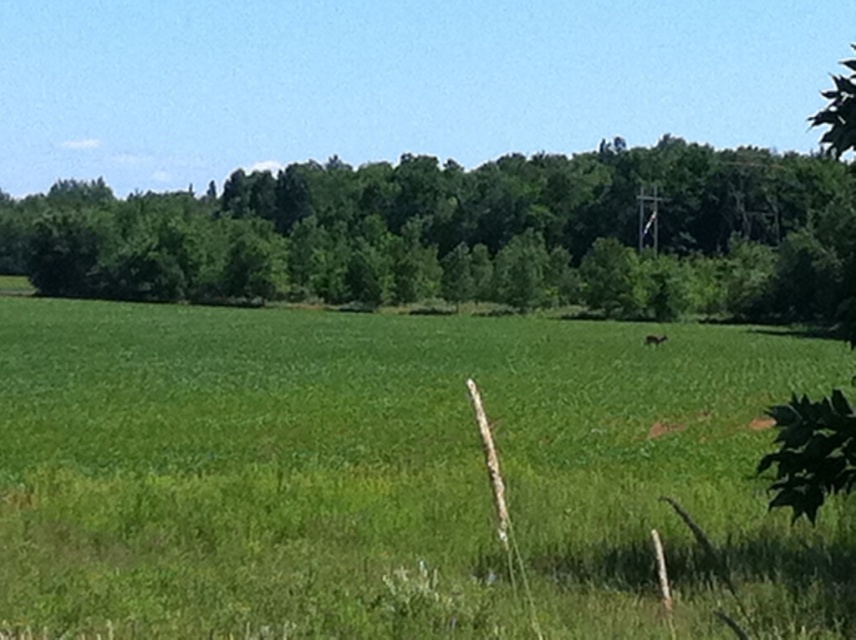
Can you confirm if green leafy tree at center is taller than brown furry deer at center?

Yes, green leafy tree at center is taller than brown furry deer at center.

Is point (837, 212) positioned behind point (645, 339)?

That is True.

Is point (715, 163) farther from camera compared to point (646, 344)?

Yes.

The image size is (856, 640). Identify the location of green leafy tree at center. (467, 234).

Describe the element at coordinates (394, 470) in the screenshot. The image size is (856, 640). I see `green grass pasture at center` at that location.

What are the coordinates of `green grass pasture at center` in the screenshot? It's located at (394, 470).

At what (x,y) coordinates should I click in order to perform the action: click on green grass pasture at center. Please return your answer as a coordinate pair (x, y). Image resolution: width=856 pixels, height=640 pixels. Looking at the image, I should click on (394, 470).

Does green grass pasture at center appear on the right side of brown furry deer at center?

No, green grass pasture at center is not to the right of brown furry deer at center.

Describe the element at coordinates (394, 470) in the screenshot. I see `green grass pasture at center` at that location.

Between point (302, 628) and point (658, 337), which one is positioned in front?

Positioned in front is point (302, 628).

At what (x,y) coordinates should I click in order to perform the action: click on green grass pasture at center. Please return your answer as a coordinate pair (x, y). The width and height of the screenshot is (856, 640). Looking at the image, I should click on (394, 470).